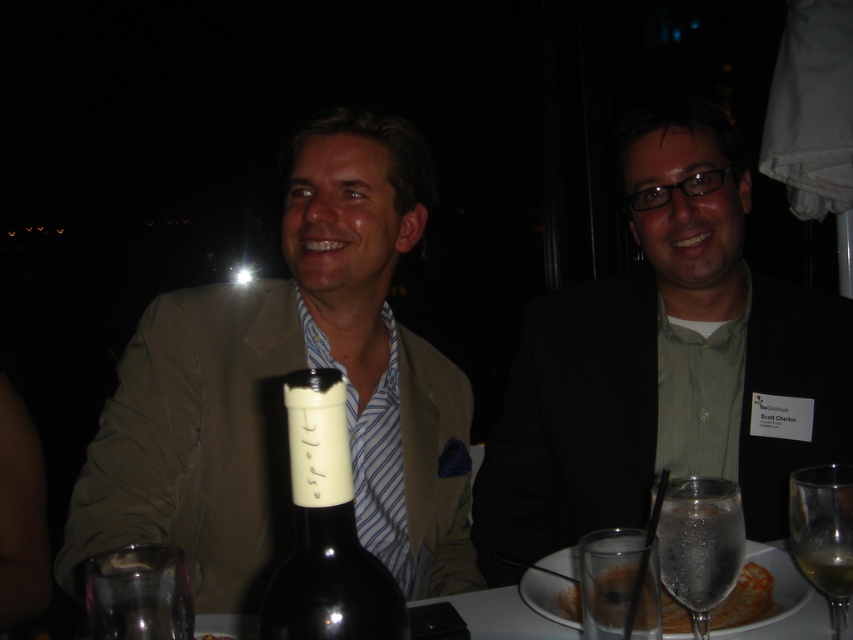
Is dark glass bottle at center taller than clear glass champagne flute at center?

Correct, dark glass bottle at center is much taller as clear glass champagne flute at center.

Locate an element on the screen. This screenshot has height=640, width=853. dark glass bottle at center is located at coordinates (326, 531).

Between clear glass at lower left and clear glass wine glass at lower right, which one is positioned higher?

clear glass at lower left is above.

Does point (154, 624) lie in front of point (838, 637)?

Yes, point (154, 624) is closer to viewer.

Locate an element on the screen. The height and width of the screenshot is (640, 853). clear glass at lower left is located at coordinates (138, 593).

Is point (639, 164) positioned after point (682, 496)?

Yes.

Does matte black suit at center have a larger size compared to clear glass at lower right?

Indeed, matte black suit at center has a larger size compared to clear glass at lower right.

At what (x,y) coordinates should I click in order to perform the action: click on matte black suit at center. Please return your answer as a coordinate pair (x, y). This screenshot has height=640, width=853. Looking at the image, I should click on (660, 362).